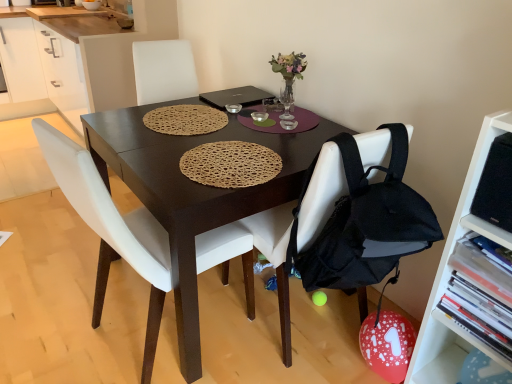
Question: Is the depth of white plastic shelf at right less than that of black matte laptop at center?

Choices:
 (A) no
 (B) yes

Answer: (B)

Question: Considering the relative sizes of white plastic shelf at right and black matte laptop at center in the image provided, is white plastic shelf at right shorter than black matte laptop at center?

Choices:
 (A) yes
 (B) no

Answer: (B)

Question: Does white plastic shelf at right have a smaller size compared to black matte laptop at center?

Choices:
 (A) no
 (B) yes

Answer: (A)

Question: From the image's perspective, does white plastic shelf at right appear higher than black matte laptop at center?

Choices:
 (A) no
 (B) yes

Answer: (A)

Question: From a real-world perspective, is white plastic shelf at right under black matte laptop at center?

Choices:
 (A) yes
 (B) no

Answer: (A)

Question: In the image, is white matte cabinet at upper left on the left side or the right side of black matte laptop at center?

Choices:
 (A) right
 (B) left

Answer: (B)

Question: Choose the correct answer: Is white matte cabinet at upper left inside black matte laptop at center or outside it?

Choices:
 (A) outside
 (B) inside

Answer: (A)

Question: Is white matte cabinet at upper left taller or shorter than black matte laptop at center?

Choices:
 (A) tall
 (B) short

Answer: (A)

Question: Looking at the image, does white matte cabinet at upper left seem bigger or smaller compared to black matte laptop at center?

Choices:
 (A) small
 (B) big

Answer: (B)

Question: From the image's perspective, relative to white leather chair at center, arranged as the 1th chair when viewed from the left, is white matte cabinet at upper left above or below?

Choices:
 (A) above
 (B) below

Answer: (A)

Question: Looking at their shapes, would you say white matte cabinet at upper left is wider or thinner than white leather chair at center, arranged as the 1th chair when viewed from the left?

Choices:
 (A) wide
 (B) thin

Answer: (A)

Question: Considering the positions of white matte cabinet at upper left and white leather chair at center, arranged as the 1th chair when viewed from the left, in the image, is white matte cabinet at upper left taller or shorter than white leather chair at center, arranged as the 1th chair when viewed from the left,?

Choices:
 (A) tall
 (B) short

Answer: (B)

Question: Would you say white matte cabinet at upper left is inside or outside white leather chair at center, positioned as the second chair in right-to-left order?

Choices:
 (A) inside
 (B) outside

Answer: (B)

Question: Looking at the image, does white plastic shelf at right seem bigger or smaller compared to black matte laptop at center?

Choices:
 (A) small
 (B) big

Answer: (B)

Question: In the image, is white plastic shelf at right positioned in front of or behind black matte laptop at center?

Choices:
 (A) behind
 (B) front

Answer: (B)